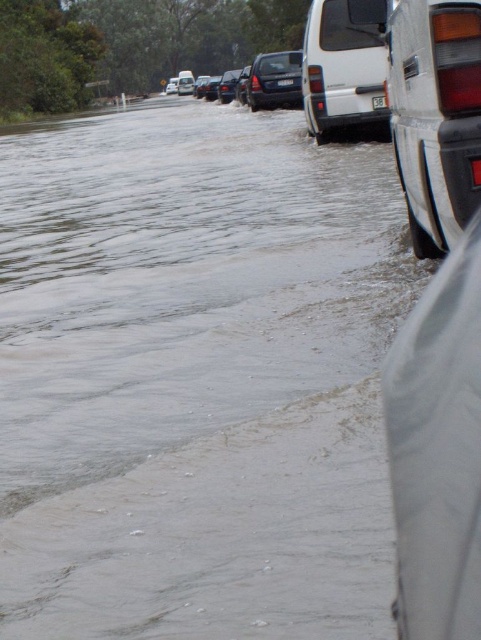
You are a delivery driver who needs to navigate through the flooded road. You see a white matte van at center and a shiny black suv at center. Which vehicle is positioned to the right side of the other?

The white matte van at center is to the right of the shiny black suv at center.

You are a delivery driver trying to navigate through the flooded area. You see a matte black suv at right. Is there enough space between the point at coordinates (435, 115) and the matte black suv at right to safely pass through with your delivery van?

The point at coordinates (435, 115) corresponds to the matte black suv at right, so there is no space between them to safely pass through with your delivery van.

You are a driver trying to navigate through the flooded road. You see a matte black suv at right and a shiny metallic sedan at center. Which vehicle should you avoid driving through the water near to prevent getting stuck?

You should avoid driving near the matte black suv at right because it has lesser height compared to the shiny metallic sedan at center, making it more prone to getting stuck in deeper water.